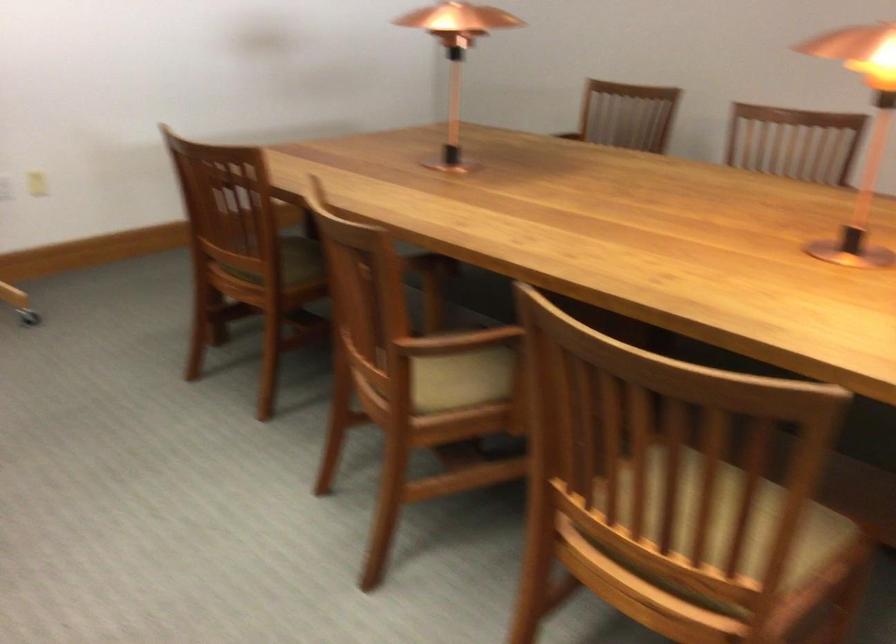
What do you see at coordinates (28, 317) in the screenshot? I see `a caster wheel` at bounding box center [28, 317].